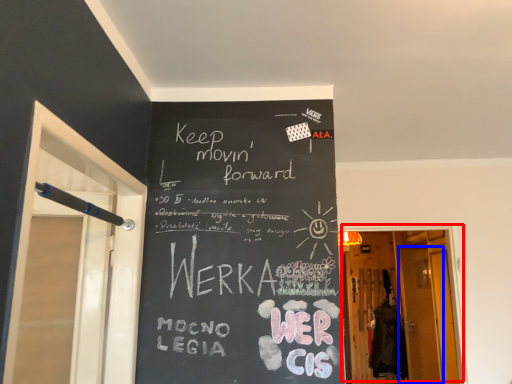
Question: Which point is closer to the camera, door (highlighted by a red box) or screen door (highlighted by a blue box)?

Choices:
 (A) door
 (B) screen door

Answer: (A)